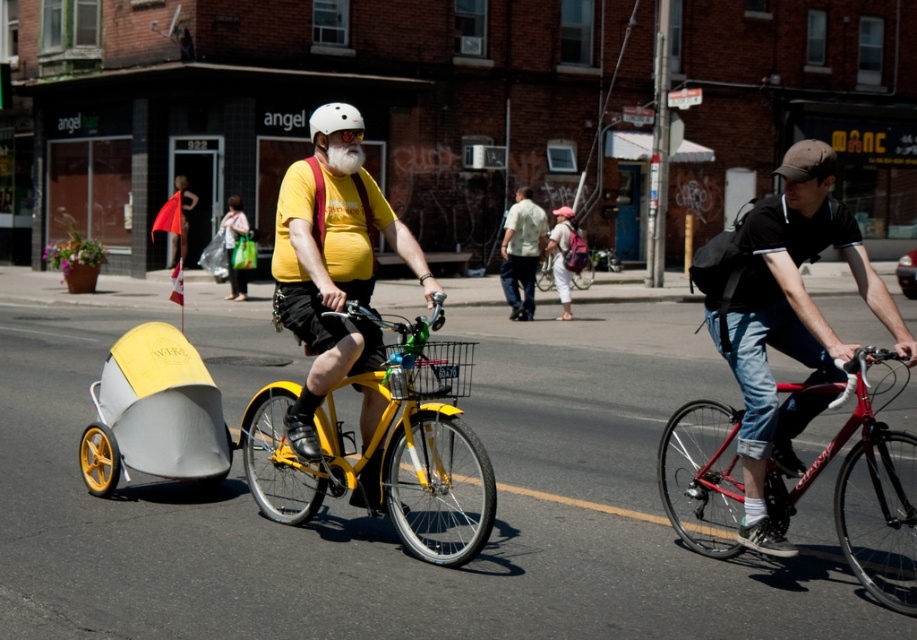
Between light beige shirt at center and matte black bicycle at center, which one is positioned higher?

light beige shirt at center is higher up.

Does light beige shirt at center appear on the right side of matte black bicycle at center?

Incorrect, light beige shirt at center is not on the right side of matte black bicycle at center.

Between point (516, 250) and point (588, 253), which one is positioned in front?

Point (516, 250)

Locate an element on the screen. The width and height of the screenshot is (917, 640). light beige shirt at center is located at coordinates (521, 252).

Between denim jeans at center and matte yellow bicycle at center, which one appears on the right side from the viewer's perspective?

Positioned to the right is denim jeans at center.

Is denim jeans at center bigger than matte yellow bicycle at center?

No, denim jeans at center is not bigger than matte yellow bicycle at center.

This screenshot has height=640, width=917. I want to click on denim jeans at center, so click(788, 321).

Between point (891, 516) and point (564, 310), which one is positioned in front?

Point (891, 516) is in front.

Looking at this image, who is higher up, shiny red bicycle at right or matte pink backpack at center?

Positioned higher is matte pink backpack at center.

Between point (737, 500) and point (564, 276), which one is positioned behind?

Point (564, 276)

Image resolution: width=917 pixels, height=640 pixels. I want to click on shiny red bicycle at right, so click(866, 497).